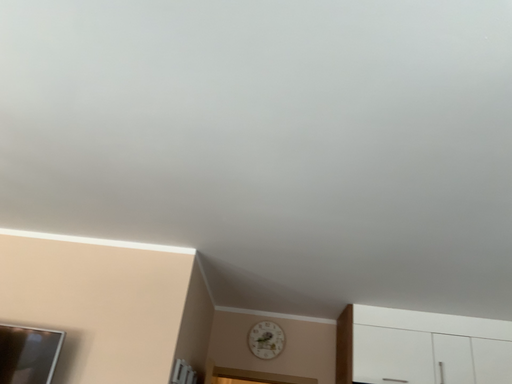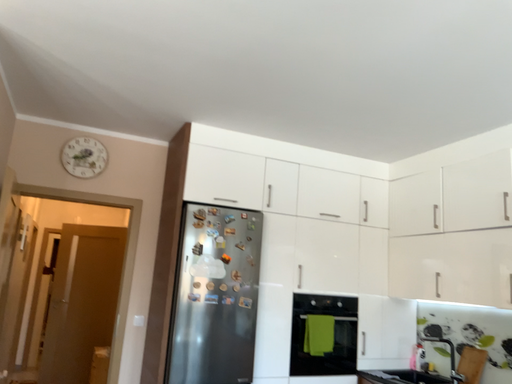
Question: How did the camera likely rotate when shooting the video?

Choices:
 (A) rotated right
 (B) rotated left

Answer: (A)